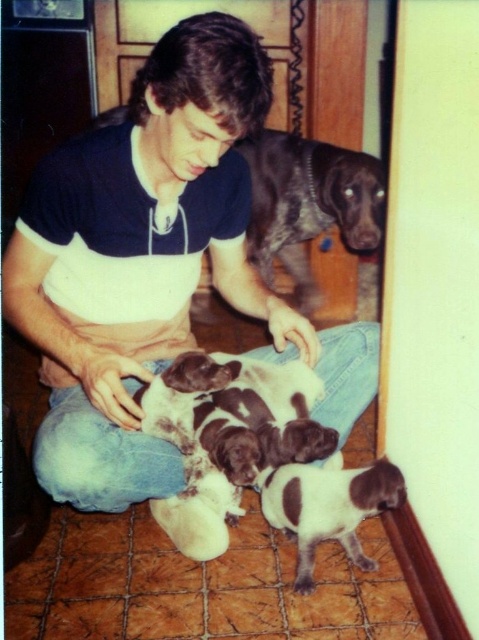
Question: Is matte black t-shirt at center above white-furred dog at lower center?

Choices:
 (A) no
 (B) yes

Answer: (B)

Question: Which point appears farthest from the camera in this image?

Choices:
 (A) (355, 396)
 (B) (291, 500)
 (C) (255, 237)

Answer: (C)

Question: Is matte black t-shirt at center smaller than shiny brown dog at upper center?

Choices:
 (A) no
 (B) yes

Answer: (A)

Question: Estimate the real-world distances between objects in this image. Which object is farther from the shiny brown dog at upper center?

Choices:
 (A) white and brown fur puppies at center
 (B) white-furred dog at lower center

Answer: (B)

Question: Considering the real-world distances, which object is farthest from the white and brown fur puppies at center?

Choices:
 (A) shiny brown dog at upper center
 (B) white-furred dog at lower center
 (C) matte black t-shirt at center

Answer: (A)

Question: Observing the image, what is the correct spatial positioning of shiny brown dog at upper center in reference to white-furred dog at lower center?

Choices:
 (A) above
 (B) below

Answer: (A)